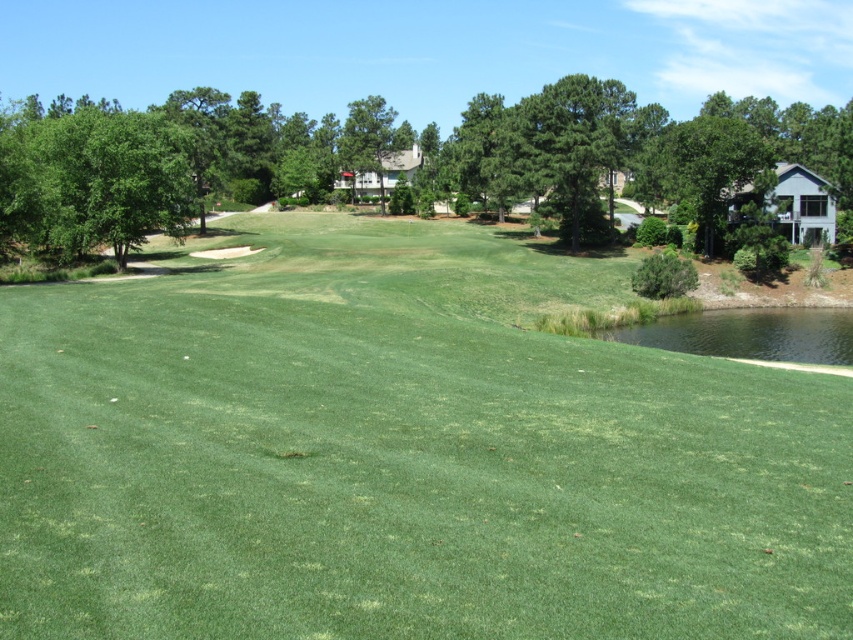
Question: Estimate the real-world distances between objects in this image. Which object is farther from the green leafy tree at upper left?

Choices:
 (A) green grass at center
 (B) green leafy tree at upper center

Answer: (B)

Question: Among these points, which one is nearest to the camera?

Choices:
 (A) (407, 125)
 (B) (213, 116)

Answer: (B)

Question: Can you confirm if green grass at center is wider than green leafy tree at upper center?

Choices:
 (A) yes
 (B) no

Answer: (B)

Question: Where is green grass at center located in relation to green leafy tree at upper center in the image?

Choices:
 (A) below
 (B) above

Answer: (A)

Question: Which point is farther from the camera taking this photo?

Choices:
 (A) (311, 177)
 (B) (350, 362)
 (C) (364, 120)

Answer: (A)

Question: Can you confirm if green leafy tree at upper left is positioned to the right of green leafy tree at center?

Choices:
 (A) yes
 (B) no

Answer: (B)